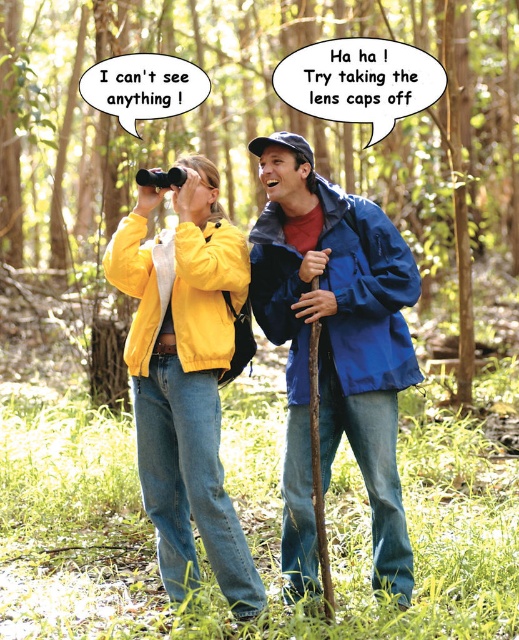
You are a hiker who wants to take a photo of the green matte forest at center from the position of the person wearing the matte yellow jacket at center. What is the minimum distance you need to move forward to ensure the entire forest fits in your camera frame?

The green matte forest at center is 8.30 meters away from the matte yellow jacket at center. To ensure the entire forest fits in your camera frame, you need to move forward at least 8.30 meters.

Based on the scene description, which object occupies more space in the image between the green matte forest at center and the blue waterproof jacket at center?

The green matte forest at center occupies more space in the image than the blue waterproof jacket at center because it is described as larger in size.